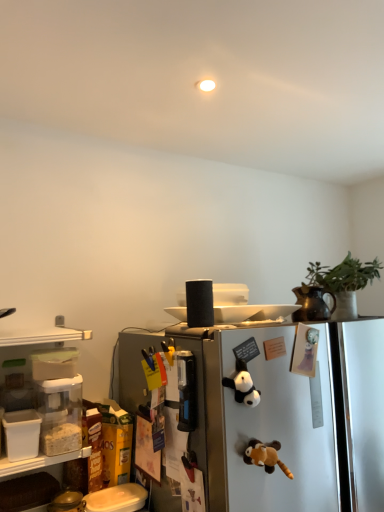
Describe the element at coordinates (275, 414) in the screenshot. I see `satin silver refrigerator at center` at that location.

How much space does black plush panda at center, positioned as the first toy in top-to-bottom order, occupy vertically?

It is 5.36 inches.

Locate an element on the screen. green matte plant at upper right is located at coordinates (343, 274).

Find the location of a particular element. The image size is (384, 512). the 2nd toy in front of the green matte plant at upper right, starting your count from the anchor is located at coordinates (265, 456).

In terms of size, does green matte plant at upper right appear bigger or smaller than brown plush toy at center, marked as the second toy in a top-to-bottom arrangement?

Clearly, green matte plant at upper right is larger in size than brown plush toy at center, marked as the second toy in a top-to-bottom arrangement.

From a real-world perspective, is green matte plant at upper right above or below brown plush toy at center, the first toy in the bottom-to-top sequence?

In terms of real-world spatial position, green matte plant at upper right is above brown plush toy at center, the first toy in the bottom-to-top sequence.

From the image's perspective, which one is positioned higher, green matte plant at upper right or brown plush toy at center, the first toy in the bottom-to-top sequence?

green matte plant at upper right, from the image's perspective.

Is point (247, 452) positioned behind point (290, 433)?

No, (247, 452) is in front of (290, 433).

Considering the positions of objects brown plush toy at center, the first toy in the bottom-to-top sequence, and satin silver refrigerator at center in the image provided, who is in front, brown plush toy at center, the first toy in the bottom-to-top sequence, or satin silver refrigerator at center?

Positioned in front is satin silver refrigerator at center.

Can you see brown plush toy at center, marked as the second toy in a top-to-bottom arrangement, touching satin silver refrigerator at center?

No, brown plush toy at center, marked as the second toy in a top-to-bottom arrangement, is not touching satin silver refrigerator at center.

Which is more to the left, brown plush toy at center, the first toy in the bottom-to-top sequence, or satin silver refrigerator at center?

brown plush toy at center, the first toy in the bottom-to-top sequence.

Does point (357, 495) come closer to viewer compared to point (238, 361)?

No.

Is satin silver refrigerator at center shorter than black plush panda at center, the 2th toy when ordered from bottom to top?

In fact, satin silver refrigerator at center may be taller than black plush panda at center, the 2th toy when ordered from bottom to top.

Between satin silver refrigerator at center and black plush panda at center, positioned as the first toy in top-to-bottom order, which one has smaller width?

black plush panda at center, positioned as the first toy in top-to-bottom order, is thinner.

From the image's perspective, is satin silver refrigerator at center located beneath black plush panda at center, the 2th toy when ordered from bottom to top?

Correct, satin silver refrigerator at center appears lower than black plush panda at center, the 2th toy when ordered from bottom to top, in the image.

From a real-world perspective, is black plush panda at center, positioned as the first toy in top-to-bottom order, positioned under green matte plant at upper right based on gravity?

Yes, from a real-world perspective, black plush panda at center, positioned as the first toy in top-to-bottom order, is below green matte plant at upper right.

From the picture: Which object is wider, black plush panda at center, the 2th toy when ordered from bottom to top, or green matte plant at upper right?

green matte plant at upper right is wider.

Measure the distance from black plush panda at center, positioned as the first toy in top-to-bottom order, to green matte plant at upper right.

They are 27.88 inches apart.

Which of these two, brown plush toy at center, the first toy in the bottom-to-top sequence, or green matte plant at upper right, is smaller?

With smaller size is brown plush toy at center, the first toy in the bottom-to-top sequence.

From a real-world perspective, relative to green matte plant at upper right, is brown plush toy at center, marked as the second toy in a top-to-bottom arrangement, vertically above or below?

In terms of real-world spatial position, brown plush toy at center, marked as the second toy in a top-to-bottom arrangement, is below green matte plant at upper right.

Which is behind, point (260, 461) or point (327, 266)?

Point (327, 266)

Is brown plush toy at center, the first toy in the bottom-to-top sequence, thinner than green matte plant at upper right?

Yes.

Where is `toy on the left of brown plush toy at center, the first toy in the bottom-to-top sequence`? This screenshot has width=384, height=512. toy on the left of brown plush toy at center, the first toy in the bottom-to-top sequence is located at coordinates (243, 385).

Does brown plush toy at center, the first toy in the bottom-to-top sequence, come behind black plush panda at center, the 2th toy when ordered from bottom to top?

That is False.

From the image's perspective, is brown plush toy at center, marked as the second toy in a top-to-bottom arrangement, on top of black plush panda at center, the 2th toy when ordered from bottom to top?

No, from the image's perspective, brown plush toy at center, marked as the second toy in a top-to-bottom arrangement, is not over black plush panda at center, the 2th toy when ordered from bottom to top.

Does point (322, 267) appear closer or farther from the camera than point (375, 467)?

Point (322, 267) appears to be farther away from the viewer than point (375, 467).

Who is taller, green matte plant at upper right or satin silver refrigerator at center?

satin silver refrigerator at center is taller.

Consider the image. Is green matte plant at upper right in contact with satin silver refrigerator at center?

No, green matte plant at upper right is not with satin silver refrigerator at center.

Locate an element on the screen. The height and width of the screenshot is (512, 384). plant above the brown plush toy at center, the first toy in the bottom-to-top sequence (from the image's perspective) is located at coordinates (343, 274).

There is a satin silver refrigerator at center. Where is `the 1st toy above it (from a real-world perspective)`? the 1st toy above it (from a real-world perspective) is located at coordinates (265, 456).

From the image, which object appears to be farther from brown plush toy at center, the first toy in the bottom-to-top sequence, green matte plant at upper right or satin silver refrigerator at center?

green matte plant at upper right lies further to brown plush toy at center, the first toy in the bottom-to-top sequence, than the other object.

Which object lies further to the anchor point green matte plant at upper right, brown plush toy at center, marked as the second toy in a top-to-bottom arrangement, or black plush panda at center, the 2th toy when ordered from bottom to top?

The object further to green matte plant at upper right is brown plush toy at center, marked as the second toy in a top-to-bottom arrangement.

Considering their positions, is black plush panda at center, the 2th toy when ordered from bottom to top, positioned closer to green matte plant at upper right than satin silver refrigerator at center?

Among the two, satin silver refrigerator at center is located nearer to green matte plant at upper right.

From the image, which object appears to be nearer to green matte plant at upper right, satin silver refrigerator at center or black plush panda at center, positioned as the first toy in top-to-bottom order?

Based on the image, satin silver refrigerator at center appears to be nearer to green matte plant at upper right.

Based on their spatial positions, is black plush panda at center, positioned as the first toy in top-to-bottom order, or green matte plant at upper right further from brown plush toy at center, marked as the second toy in a top-to-bottom arrangement?

green matte plant at upper right.

Looking at this image, based on their spatial positions, is brown plush toy at center, the first toy in the bottom-to-top sequence, or green matte plant at upper right further from black plush panda at center, positioned as the first toy in top-to-bottom order?

Among the two, green matte plant at upper right is located further to black plush panda at center, positioned as the first toy in top-to-bottom order.

From the image, which object appears to be nearer to brown plush toy at center, the first toy in the bottom-to-top sequence, black plush panda at center, positioned as the first toy in top-to-bottom order, or satin silver refrigerator at center?

black plush panda at center, positioned as the first toy in top-to-bottom order.

When comparing their distances from brown plush toy at center, the first toy in the bottom-to-top sequence, does satin silver refrigerator at center or green matte plant at upper right seem closer?

satin silver refrigerator at center is closer to brown plush toy at center, the first toy in the bottom-to-top sequence.

Identify the location of toy between black plush panda at center, the 2th toy when ordered from bottom to top, and satin silver refrigerator at center from top to bottom. (265, 456).

The height and width of the screenshot is (512, 384). Find the location of `toy located between black plush panda at center, the 2th toy when ordered from bottom to top, and green matte plant at upper right in the left-right direction`. toy located between black plush panda at center, the 2th toy when ordered from bottom to top, and green matte plant at upper right in the left-right direction is located at coordinates (265, 456).